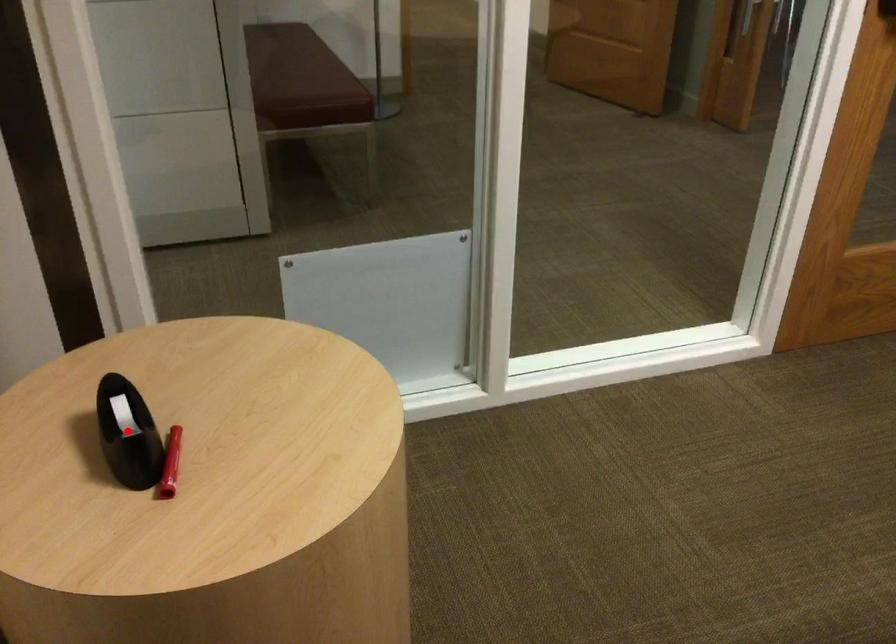
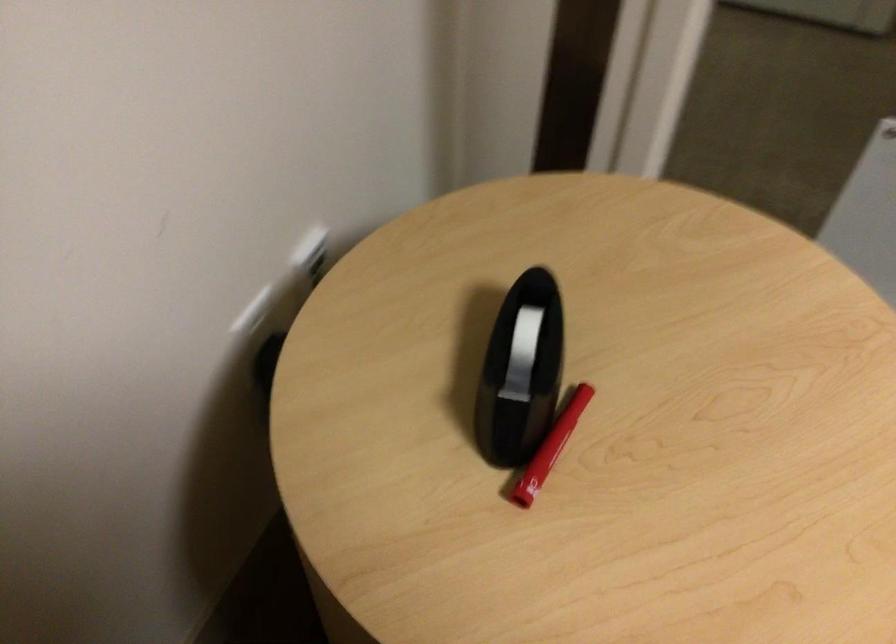
Question: I am providing you with two images of the same scene from different viewpoints. A red point is shown in image1. For the corresponding object point in image2, is it positioned nearer or farther from the camera?

Choices:
 (A) Nearer
 (B) Farther

Answer: (A)